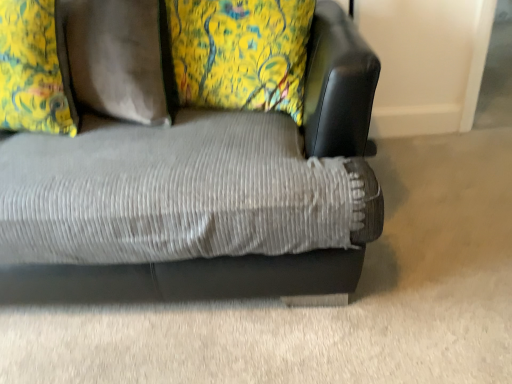
Question: Is floral fabric pillow at upper left taller or shorter than black leather swivel chair at upper right?

Choices:
 (A) tall
 (B) short

Answer: (B)

Question: Based on their sizes in the image, would you say floral fabric pillow at upper left is bigger or smaller than black leather swivel chair at upper right?

Choices:
 (A) small
 (B) big

Answer: (B)

Question: Which is farther from the floral fabric pillow at upper left?

Choices:
 (A) black leather swivel chair at upper right
 (B) corduroy fabric couch at center

Answer: (A)

Question: Which object is the closest to the corduroy fabric couch at center?

Choices:
 (A) floral fabric pillow at upper left
 (B) black leather swivel chair at upper right

Answer: (B)